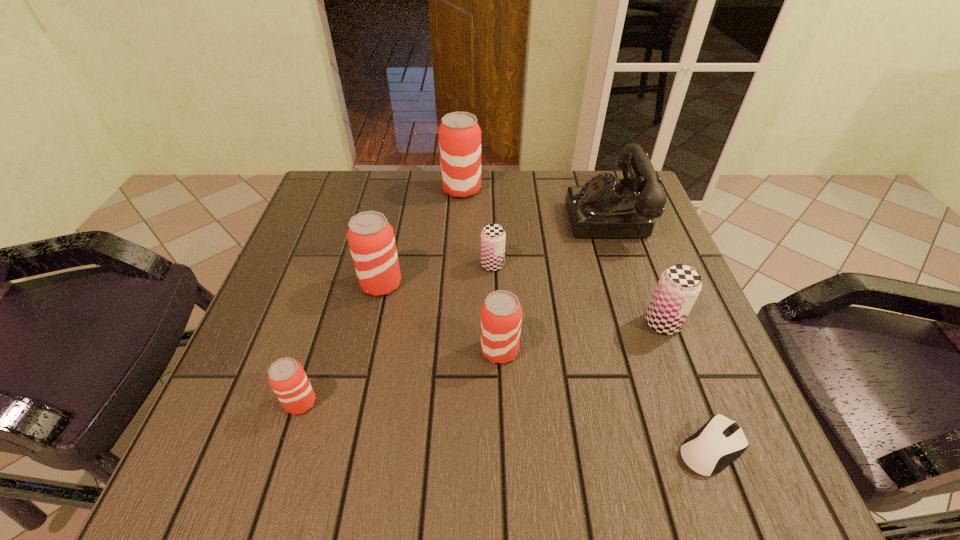
Where is `mouse that is at the right edge`? mouse that is at the right edge is located at coordinates (720, 441).

Locate an element on the screen. The width and height of the screenshot is (960, 540). object present at the far right corner is located at coordinates (604, 207).

The height and width of the screenshot is (540, 960). I want to click on object that is at the near right corner, so click(x=720, y=441).

You are a GUI agent. You are given a task and a screenshot of the screen. Output one action in this format:
    pyautogui.click(x=<x>, y=<y>)
    Task: Click on the free point at the far edge
    
    Given the screenshot: What is the action you would take?
    pyautogui.click(x=396, y=181)

Find the location of a particular element. This screenshot has height=540, width=960. vacant area at the near edge of the desktop is located at coordinates (390, 453).

In the image, there is a desktop. Where is `vacant space at the left edge`? vacant space at the left edge is located at coordinates (294, 238).

The width and height of the screenshot is (960, 540). I want to click on vacant area at the right edge, so click(x=702, y=350).

Locate an element on the screen. The width and height of the screenshot is (960, 540). vacant space at the far left corner is located at coordinates (339, 184).

The width and height of the screenshot is (960, 540). In the image, there is a desktop. Find the location of `vacant space at the near left corner`. vacant space at the near left corner is located at coordinates (290, 471).

Find the location of a particular element. This screenshot has width=960, height=540. vacant space at the far right corner of the desktop is located at coordinates click(583, 177).